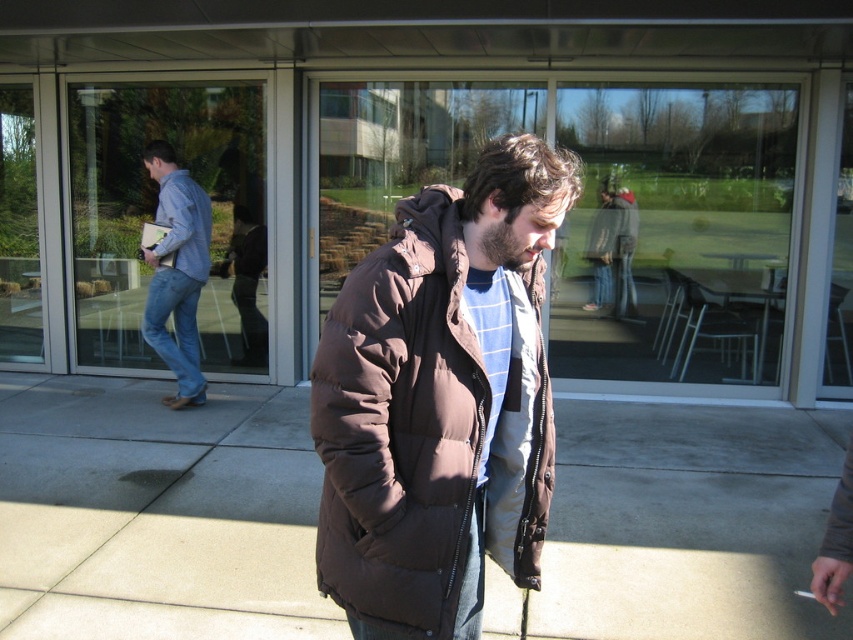
You are a delivery person trying to place a large package on the ground in front of the transparent glass door at center. The package is 1 meter wide. Is there enough space on the brown fabric pavement at center to place it without overlapping the door?

The brown fabric pavement at center is thinner than the transparent glass door at center. Since the package is 1 meter wide and the pavement is narrower than the door, it might not be wide enough to accommodate the package without overlapping the door. Check the exact dimensions before placing it.

You are standing in front of the modern building and want to determine which of the two points, point (56, 488) or point (254, 221), is closer to you. Based on the scene, which point is nearer?

Point (56, 488) is closer to the viewer than point (254, 221).

You are a photographer trying to capture the man in the brown puffy jacket at center and the person in denim jeans at left. Based on their positions, which one is closer to the camera?

The brown puffy jacket at center is below denim jeans at left, meaning the denim jeans at left is closer to the camera since objects higher up in the image are typically nearer.